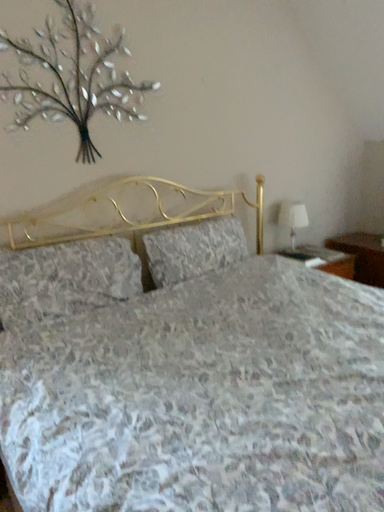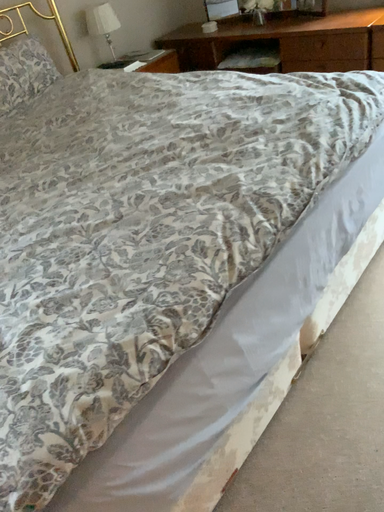
Question: Which way did the camera rotate in the video?

Choices:
 (A) rotated left
 (B) rotated right

Answer: (B)